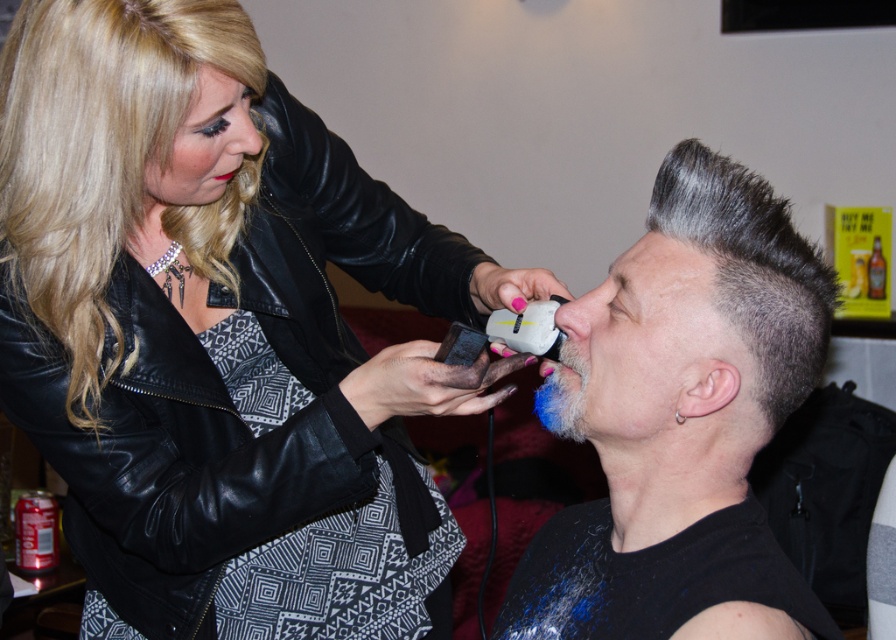
You are a photographer taking a picture of the scene. You notice two points in the image at coordinates point [699,628] and point [582,413]. Which point will appear larger in your photo?

Point [699,628] is closer to the camera than point [582,413], so it will appear larger in the photo.